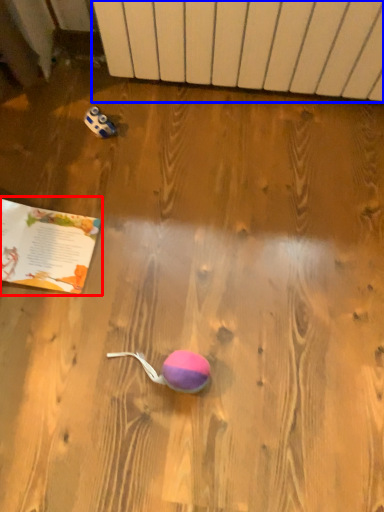
Question: Among these objects, which one is farthest to the camera, book (highlighted by a red box) or radiator (highlighted by a blue box)?

Choices:
 (A) book
 (B) radiator

Answer: (A)